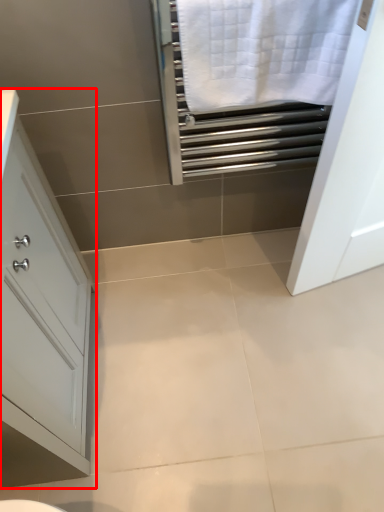
Question: From the image's perspective, where is bathroom cabinet (annotated by the red box) located in relation to bath towel in the image?

Choices:
 (A) below
 (B) above

Answer: (A)